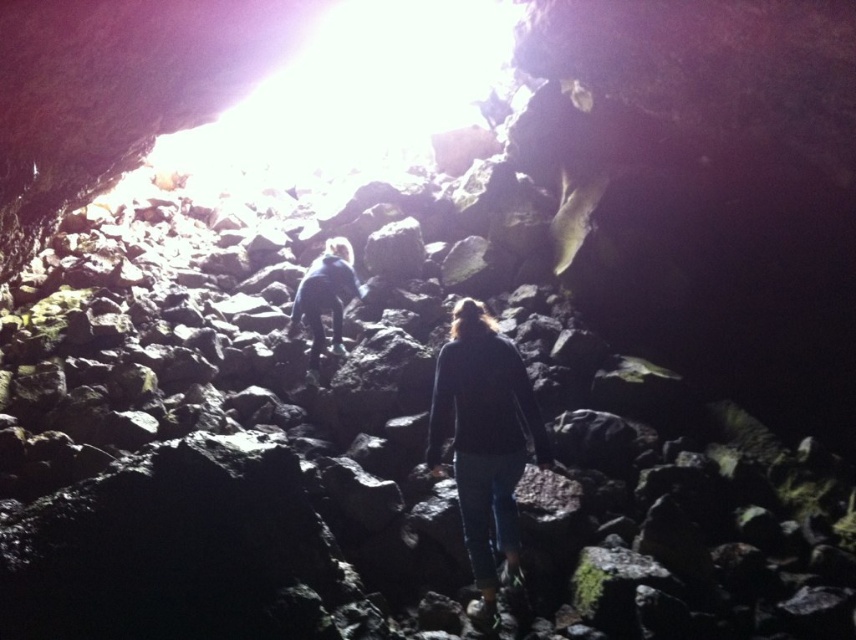
Question: Where is dark blue sweater at center located in relation to dark blue shirt at center in the image?

Choices:
 (A) right
 (B) left

Answer: (A)

Question: Which point is closer to the camera taking this photo?

Choices:
 (A) (510, 401)
 (B) (331, 250)

Answer: (A)

Question: Is dark blue sweater at center below dark blue shirt at center?

Choices:
 (A) yes
 (B) no

Answer: (A)

Question: Can you confirm if dark blue sweater at center is positioned below dark blue shirt at center?

Choices:
 (A) yes
 (B) no

Answer: (A)

Question: Which object is closer to the camera taking this photo?

Choices:
 (A) dark blue sweater at center
 (B) dark blue shirt at center

Answer: (A)